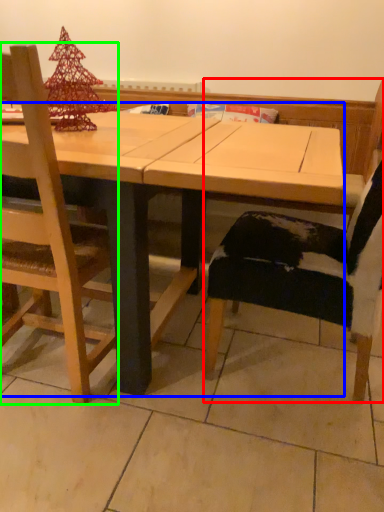
Question: Estimate the real-world distances between objects in this image. Which object is farther from chair (highlighted by a red box), table (highlighted by a blue box) or chair (highlighted by a green box)?

Choices:
 (A) table
 (B) chair

Answer: (B)